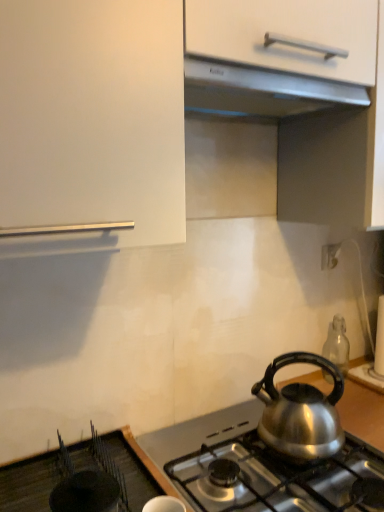
Question: Does white plastic electric outlet at upper right have a greater height compared to satin silver exhaust hood at upper center?

Choices:
 (A) yes
 (B) no

Answer: (A)

Question: Are white plastic electric outlet at upper right and satin silver exhaust hood at upper center far apart?

Choices:
 (A) no
 (B) yes

Answer: (A)

Question: Does white plastic electric outlet at upper right come behind satin silver exhaust hood at upper center?

Choices:
 (A) yes
 (B) no

Answer: (A)

Question: From the image's perspective, is white plastic electric outlet at upper right located above satin silver exhaust hood at upper center?

Choices:
 (A) no
 (B) yes

Answer: (A)

Question: Is white plastic electric outlet at upper right touching satin silver exhaust hood at upper center?

Choices:
 (A) yes
 (B) no

Answer: (B)

Question: Does white plastic electric outlet at upper right have a larger size compared to satin silver exhaust hood at upper center?

Choices:
 (A) yes
 (B) no

Answer: (B)

Question: Can you confirm if shiny metallic kettle at lower right is positioned to the right of satin silver exhaust hood at upper center?

Choices:
 (A) yes
 (B) no

Answer: (A)

Question: From the image's perspective, is shiny metallic kettle at lower right above satin silver exhaust hood at upper center?

Choices:
 (A) yes
 (B) no

Answer: (B)

Question: Would you consider shiny metallic kettle at lower right to be distant from satin silver exhaust hood at upper center?

Choices:
 (A) no
 (B) yes

Answer: (A)

Question: Can satin silver exhaust hood at upper center be found inside shiny metallic kettle at lower right?

Choices:
 (A) no
 (B) yes

Answer: (A)

Question: Is shiny metallic kettle at lower right thinner than satin silver exhaust hood at upper center?

Choices:
 (A) no
 (B) yes

Answer: (B)

Question: Can you confirm if shiny metallic kettle at lower right is smaller than satin silver exhaust hood at upper center?

Choices:
 (A) yes
 (B) no

Answer: (B)

Question: Is satin silver exhaust hood at upper center smaller than shiny metallic kettle at lower right?

Choices:
 (A) yes
 (B) no

Answer: (A)